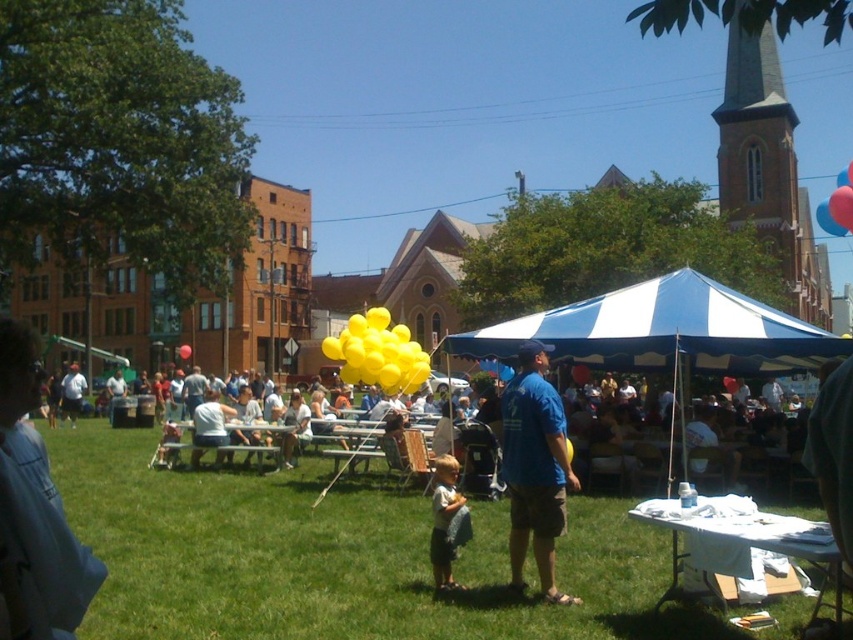
From the picture: You are planning to take a photo of the yellow balloons at center and the blue cotton shirt at center. To ensure both are fully visible in the frame, which object should you position closer to the camera?

The yellow balloons at center might be wider than blue cotton shirt at center, so you should position the yellow balloons at center closer to the camera to ensure they fit within the frame.

You are planning to set up a small picnic blanket in the park. Given the presence of the green grass at center and the blue and white striped canopy at center, which object is shorter so that the picnic blanket can be placed without obstruction?

The green grass at center is shorter than the blue and white striped canopy at center, so placing the picnic blanket there would not be obstructed by the grass.